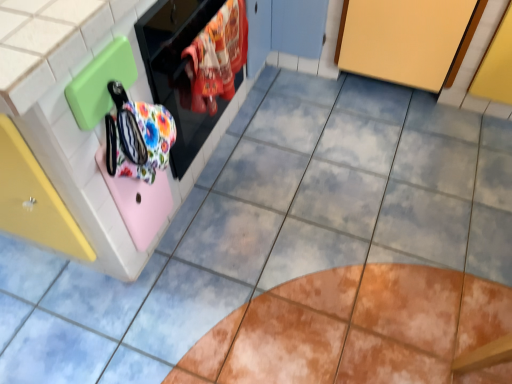
Where is `floral fabric laundry at upper left`? The height and width of the screenshot is (384, 512). floral fabric laundry at upper left is located at coordinates (216, 58).

Describe the element at coordinates (216, 58) in the screenshot. I see `floral fabric laundry at upper left` at that location.

Where is `floral fabric laundry at upper left`? floral fabric laundry at upper left is located at coordinates (216, 58).